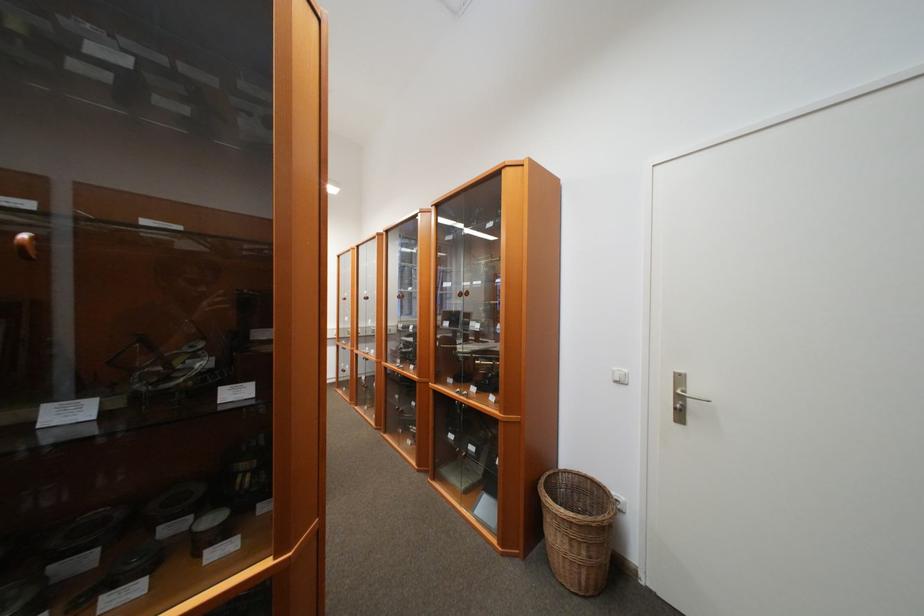
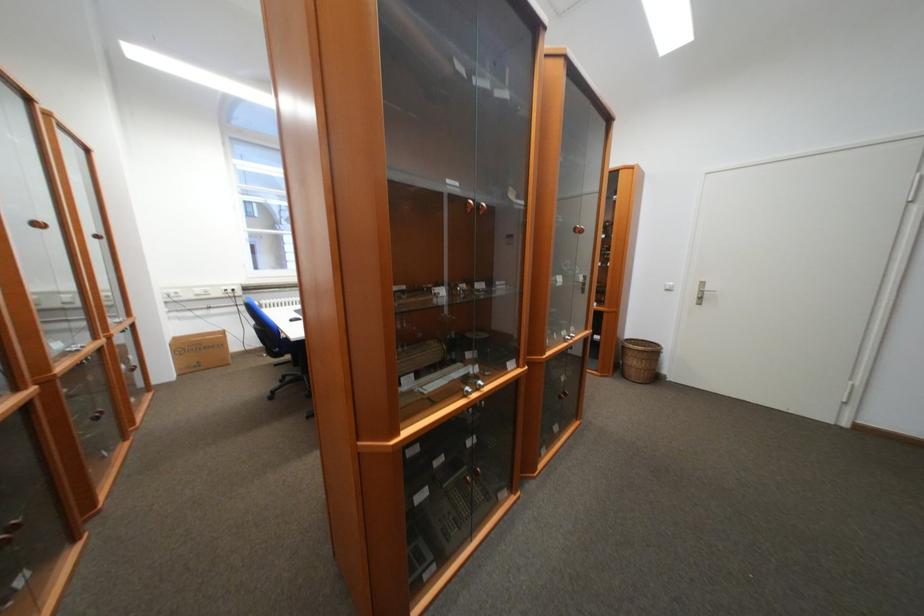
In the second image, find the point that corresponds to point 560,501 in the first image.

(640, 347)